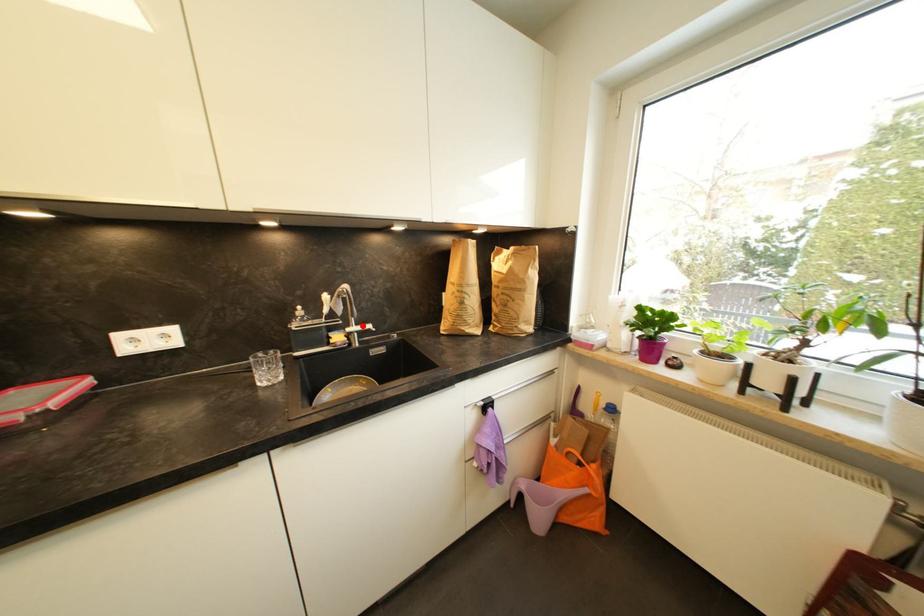
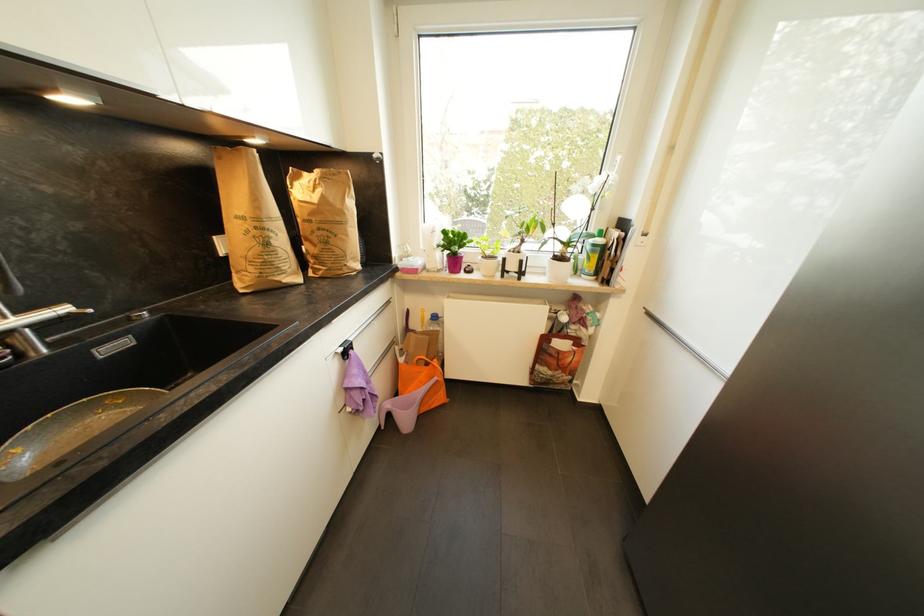
In the second image, find the point that corresponds to the highlighted location in the first image.

(27, 313)